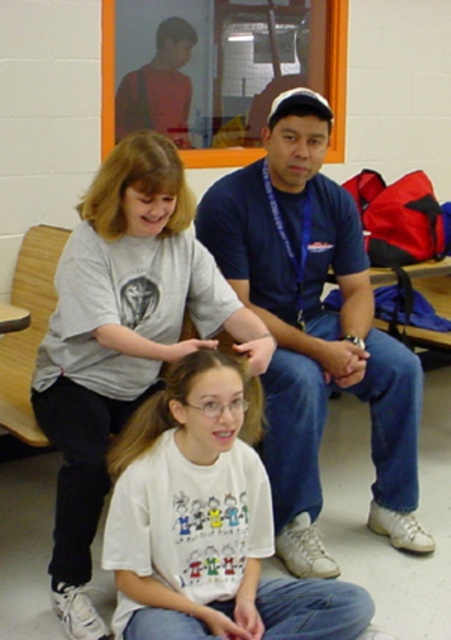
Question: Does white cotton shirt at center appear over black matte hair at center?

Choices:
 (A) no
 (B) yes

Answer: (A)

Question: Which point is closer to the camera?

Choices:
 (A) blue cotton shirt at center
 (B) white cotton shirt at center
 (C) brown silky hair at center
 (D) white cotton shirt at lower center

Answer: (D)

Question: Does blue cotton shirt at center have a greater width compared to blondehair at upper left?

Choices:
 (A) no
 (B) yes

Answer: (B)

Question: Among these points, which one is farthest from the camera?

Choices:
 (A) (161, 182)
 (B) (308, 109)

Answer: (B)

Question: Which point is closer to the camera?

Choices:
 (A) brown silky hair at center
 (B) blondehair at upper left

Answer: (A)

Question: Can you confirm if blue cotton shirt at center is positioned to the right of brown silky hair at center?

Choices:
 (A) yes
 (B) no

Answer: (A)